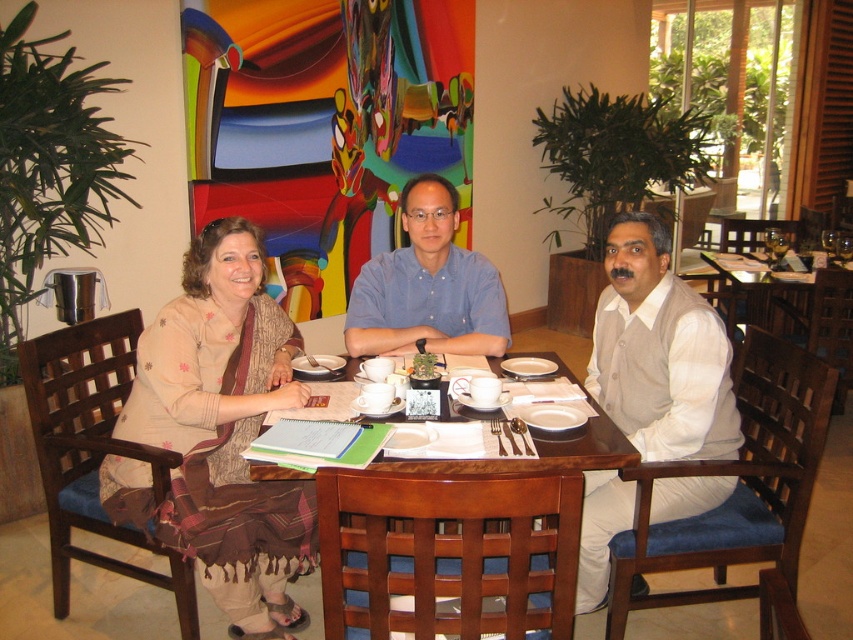
Is beige fabric saree at left bigger than wooden table at center?

Actually, beige fabric saree at left might be smaller than wooden table at center.

Is beige fabric saree at left smaller than wooden table at center?

Yes, beige fabric saree at left is smaller than wooden table at center.

Between point (184, 324) and point (421, 540), which one is positioned behind?

Point (184, 324)

Locate an element on the screen. The image size is (853, 640). beige fabric saree at left is located at coordinates (219, 433).

Who is more forward, (659, 387) or (340, 396)?

Point (659, 387) is more forward.

Based on the photo, who is lower down, beige cotton shirt at center or white glossy mug at center?

beige cotton shirt at center is lower down.

Who is more distant from viewer, (689,432) or (570,388)?

The point (570,388) is more distant.

This screenshot has height=640, width=853. What are the coordinates of `beige cotton shirt at center` in the screenshot? It's located at (659, 352).

Who is positioned more to the right, wooden table at center or beige cotton shirt at center?

beige cotton shirt at center is more to the right.

Can you confirm if wooden table at center is positioned to the left of beige cotton shirt at center?

Correct, you'll find wooden table at center to the left of beige cotton shirt at center.

Identify the location of wooden table at center. This screenshot has height=640, width=853. (460, 534).